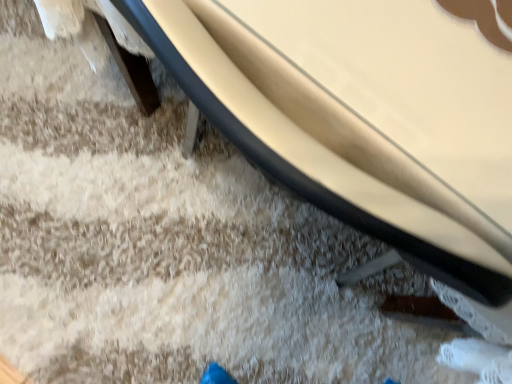
Find the location of a particular element. Image resolution: width=512 pixels, height=384 pixels. smooth beige surfboard at lower center is located at coordinates (362, 114).

This screenshot has height=384, width=512. What do you see at coordinates (362, 114) in the screenshot?
I see `smooth beige surfboard at lower center` at bounding box center [362, 114].

Identify the location of smooth beige surfboard at lower center. The image size is (512, 384). (362, 114).